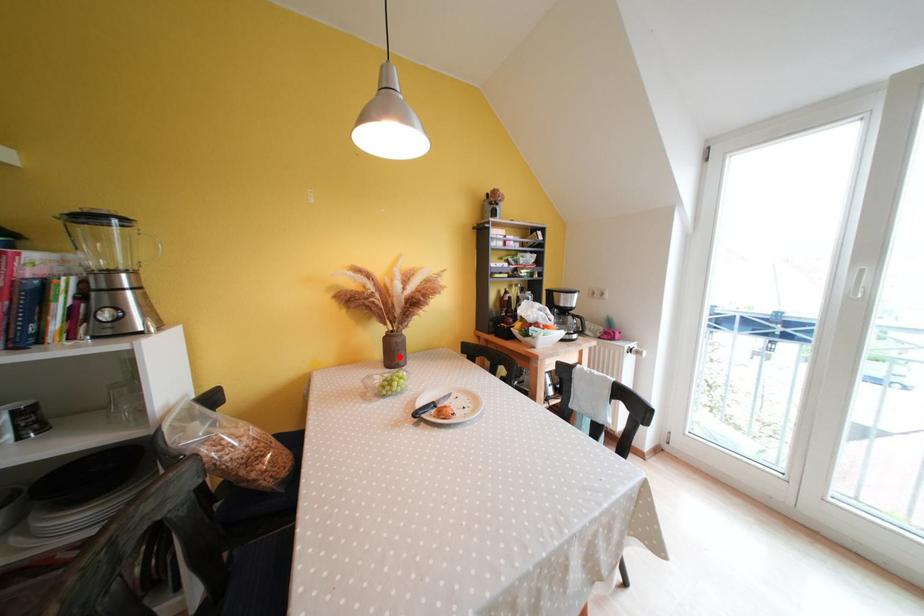
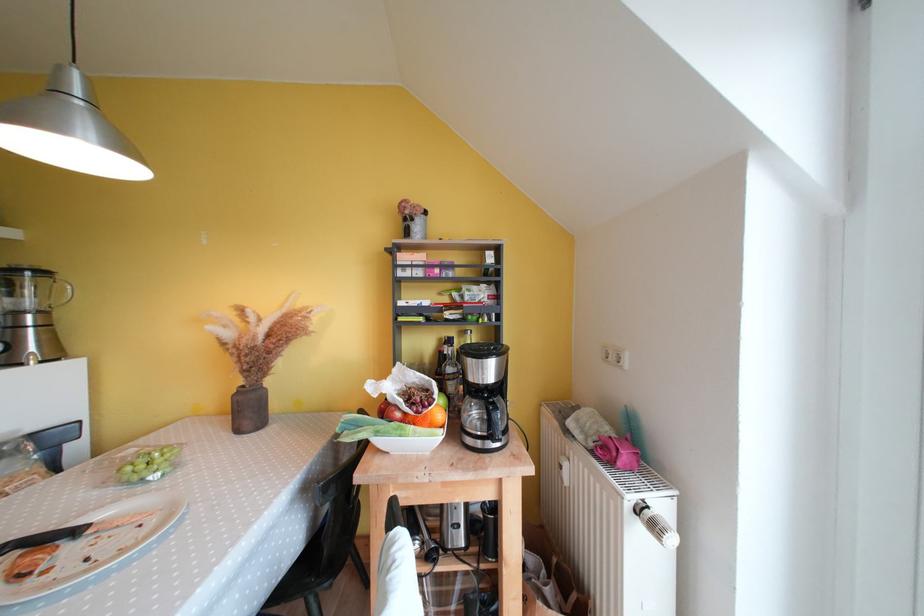
In the second image, find the point that corresponds to the highlighted location in the first image.

(256, 416)